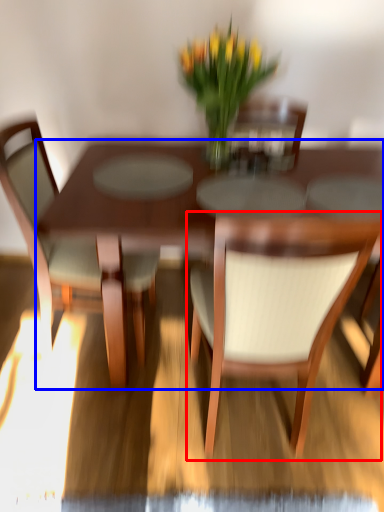
Question: Which object appears closest to the camera in this image, chair (highlighted by a red box) or kitchen & dining room table (highlighted by a blue box)?

Choices:
 (A) chair
 (B) kitchen & dining room table

Answer: (A)